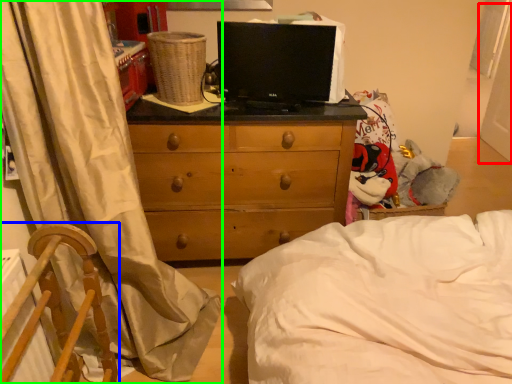
Question: Estimate the real-world distances between objects in this image. Which object is farther from screen door (highlighted by a red box), furniture (highlighted by a blue box) or curtain (highlighted by a green box)?

Choices:
 (A) furniture
 (B) curtain

Answer: (A)